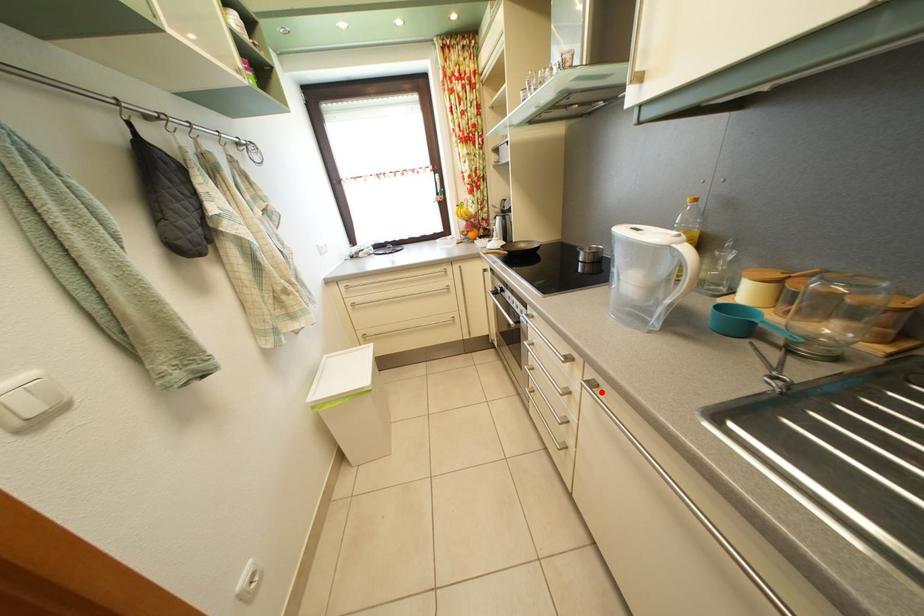
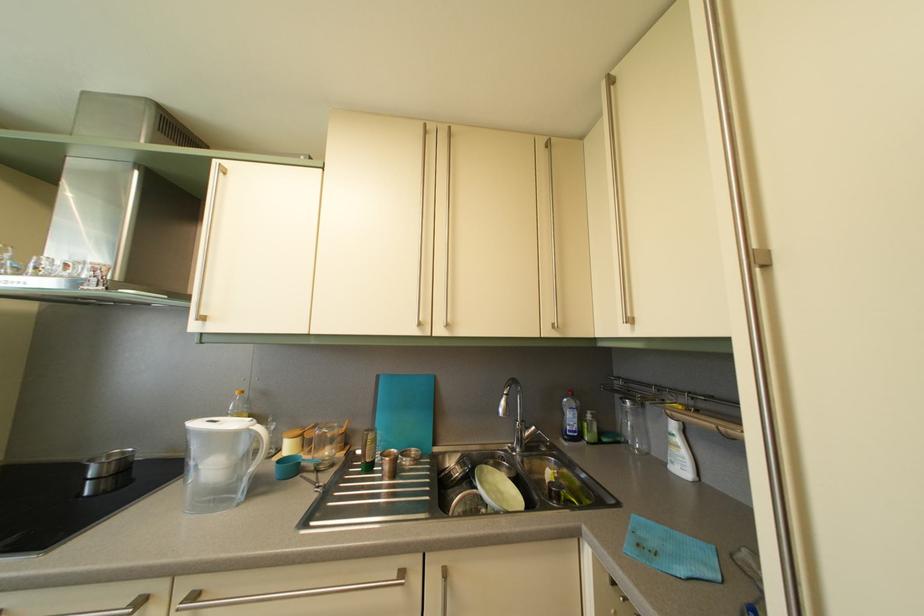
Locate, in the second image, the point that corresponds to the highlighted location in the first image.

(202, 604)